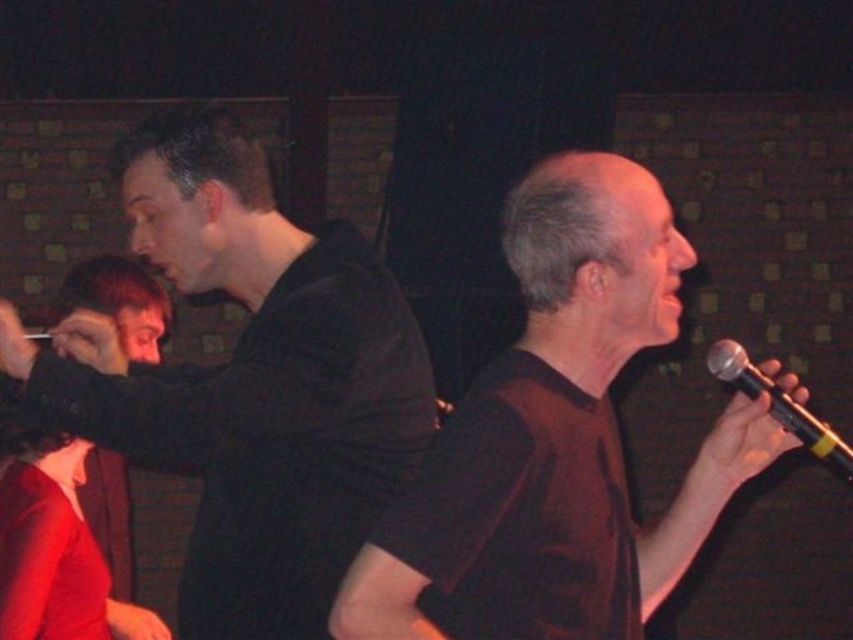
Question: Is black matte shirt at left smaller than black metallic microphone at right?

Choices:
 (A) yes
 (B) no

Answer: (B)

Question: Can you confirm if black matte shirt at left is smaller than black metallic microphone at right?

Choices:
 (A) yes
 (B) no

Answer: (B)

Question: Which point is farther to the camera?

Choices:
 (A) black matte shirt at left
 (B) brown matte shirt at right
 (C) black metallic microphone at right

Answer: (C)

Question: Estimate the real-world distances between objects in this image. Which object is farther from the black metallic microphone at right?

Choices:
 (A) brown matte shirt at right
 (B) black matte shirt at left

Answer: (B)

Question: Which of the following is the farthest from the observer?

Choices:
 (A) (416, 573)
 (B) (170, 269)

Answer: (B)

Question: Is black matte shirt at left positioned before black metallic microphone at right?

Choices:
 (A) yes
 (B) no

Answer: (A)